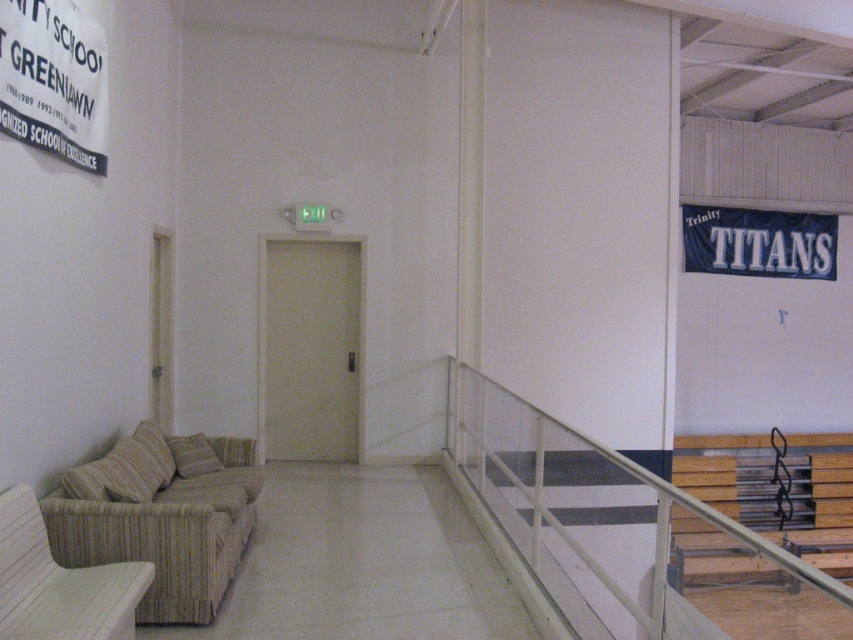
Is beige woven couch at lower left smaller than woven beige armchair at lower left?

Incorrect, beige woven couch at lower left is not smaller in size than woven beige armchair at lower left.

Between point (238, 467) and point (138, 582), which one is positioned in front?

Point (138, 582) is in front.

Where is `beige woven couch at lower left`? This screenshot has width=853, height=640. beige woven couch at lower left is located at coordinates click(x=160, y=518).

Does beige woven couch at lower left appear under beige fabric pillow at lower left?

Yes.

Does point (114, 552) lie behind point (184, 449)?

No, it is not.

The image size is (853, 640). Identify the location of beige woven couch at lower left. (160, 518).

Looking at this image, is white metal railing at upper right above beige fabric pillow at lower left?

Incorrect, white metal railing at upper right is not positioned above beige fabric pillow at lower left.

Which is more to the left, white metal railing at upper right or beige fabric pillow at lower left?

From the viewer's perspective, beige fabric pillow at lower left appears more on the left side.

Which is in front, point (569, 564) or point (204, 456)?

Positioned in front is point (569, 564).

Where is `white metal railing at upper right`? Image resolution: width=853 pixels, height=640 pixels. white metal railing at upper right is located at coordinates (625, 534).